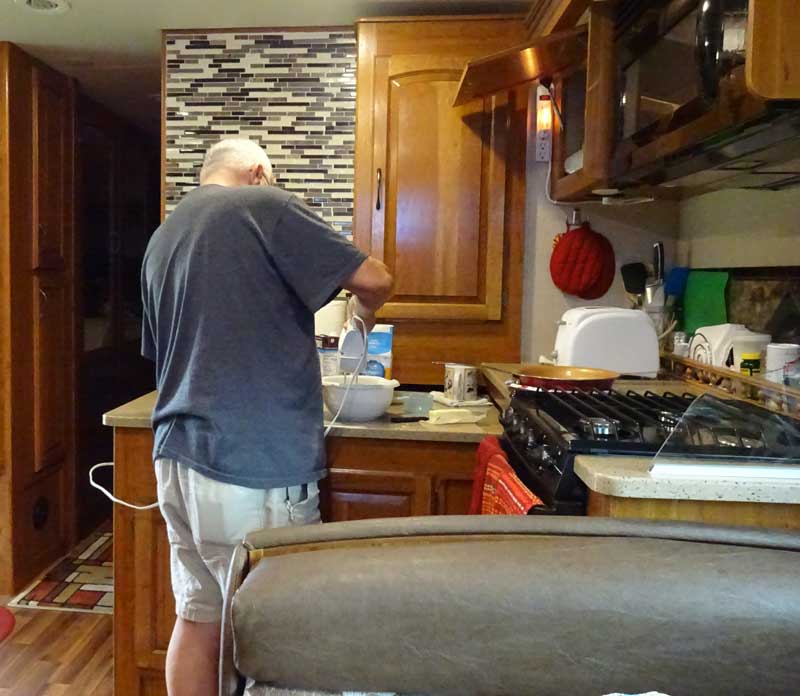
Locate an element on the screen. red pot holders is located at coordinates (590, 266).